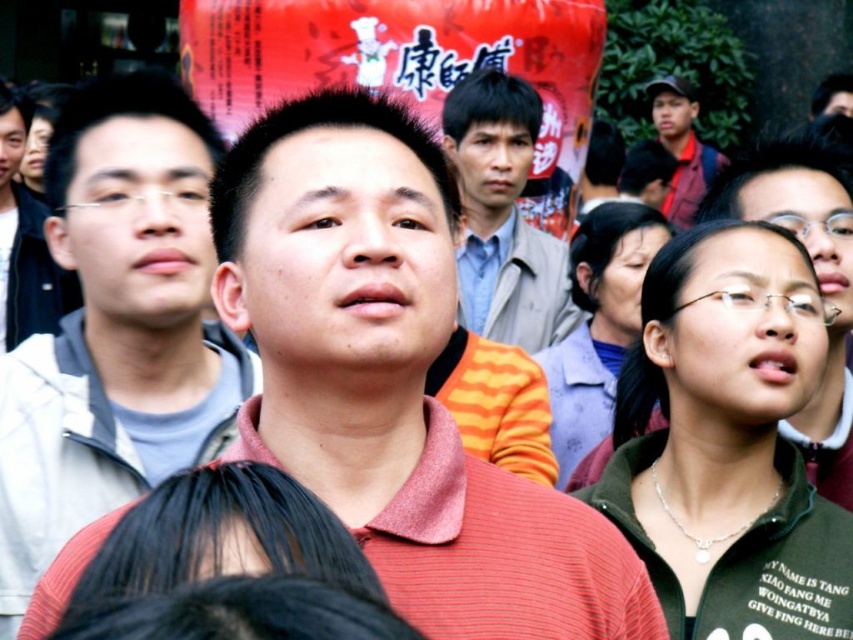
Question: Which point appears farthest from the camera in this image?

Choices:
 (A) (489, 294)
 (B) (128, 403)

Answer: (A)

Question: Which is farther from the light brown leather jacket at center?

Choices:
 (A) matte gray shirt at left
 (B) matte red shirt at center
 (C) dark blue shirt at upper right

Answer: (C)

Question: Can you confirm if matte red shirt at center is thinner than blue cotton shirt at center?

Choices:
 (A) yes
 (B) no

Answer: (B)

Question: Estimate the real-world distances between objects in this image. Which object is closer to the light brown leather jacket at center?

Choices:
 (A) matte black shirt at upper center
 (B) matte red shirt at center
 (C) blue cotton shirt at center

Answer: (C)

Question: Is the position of red matte shirt at center less distant than that of light brown leather jacket at center?

Choices:
 (A) yes
 (B) no

Answer: (A)

Question: Can you confirm if dark blue shirt at upper right is positioned to the right of matte black shirt at upper center?

Choices:
 (A) no
 (B) yes

Answer: (A)